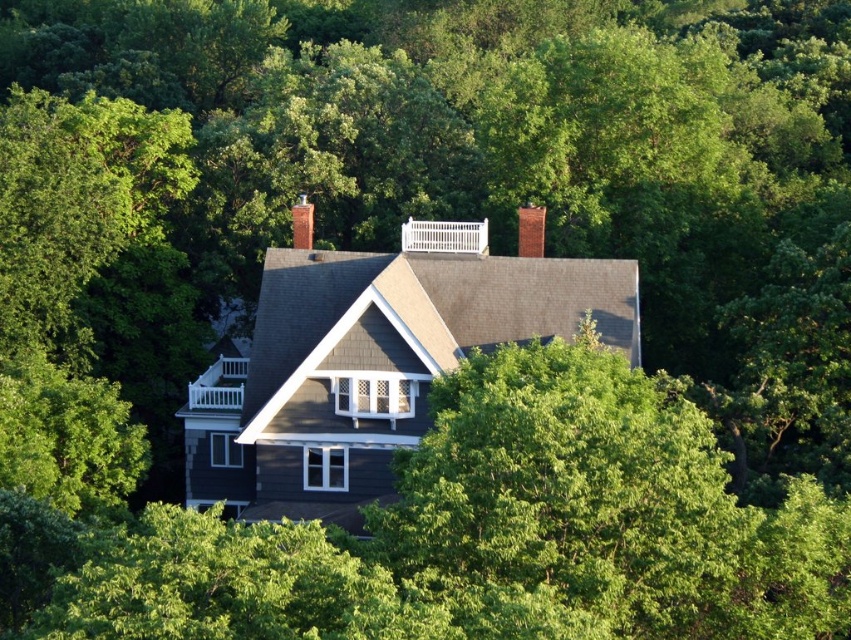
Question: Which of the following is the farthest from the observer?

Choices:
 (A) (529, 230)
 (B) (294, 221)

Answer: (B)

Question: Does red brick chimney at upper center appear over brick chimney at center?

Choices:
 (A) yes
 (B) no

Answer: (B)

Question: Can you confirm if red brick chimney at upper center is smaller than brick chimney at center?

Choices:
 (A) no
 (B) yes

Answer: (B)

Question: Can you confirm if red brick chimney at upper center is thinner than brick chimney at center?

Choices:
 (A) yes
 (B) no

Answer: (A)

Question: Which point is closer to the camera taking this photo?

Choices:
 (A) (518, 209)
 (B) (306, 205)

Answer: (B)

Question: Among these objects, which one is nearest to the camera?

Choices:
 (A) red brick chimney at upper center
 (B) brick chimney at center

Answer: (A)